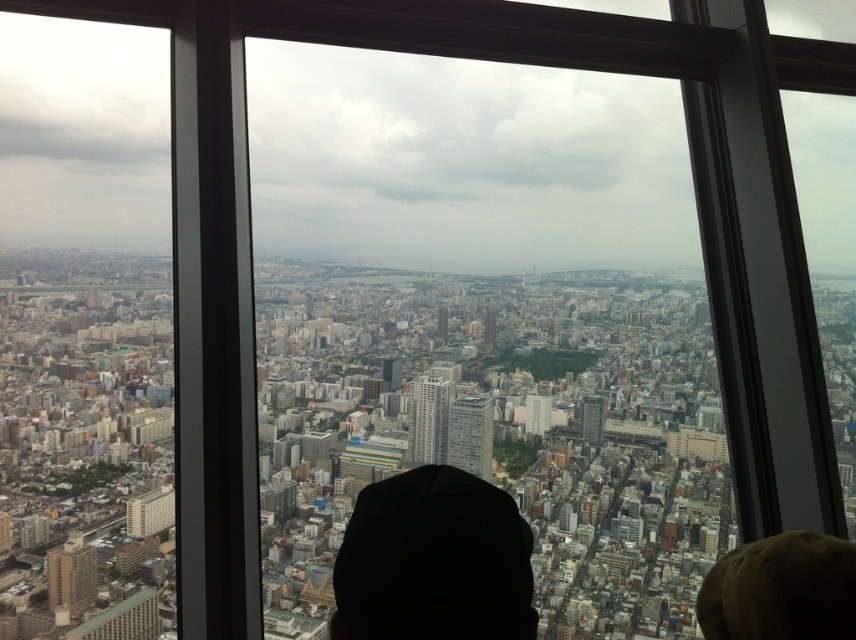
Who is positioned more to the left, black fabric cap at center or brown fuzzy hat at lower right?

black fabric cap at center is more to the left.

Which is behind, point (480, 593) or point (797, 560)?

Positioned behind is point (480, 593).

Between point (409, 579) and point (811, 593), which one is positioned behind?

Point (409, 579)

Where is `black fabric cap at center`? This screenshot has width=856, height=640. black fabric cap at center is located at coordinates (432, 561).